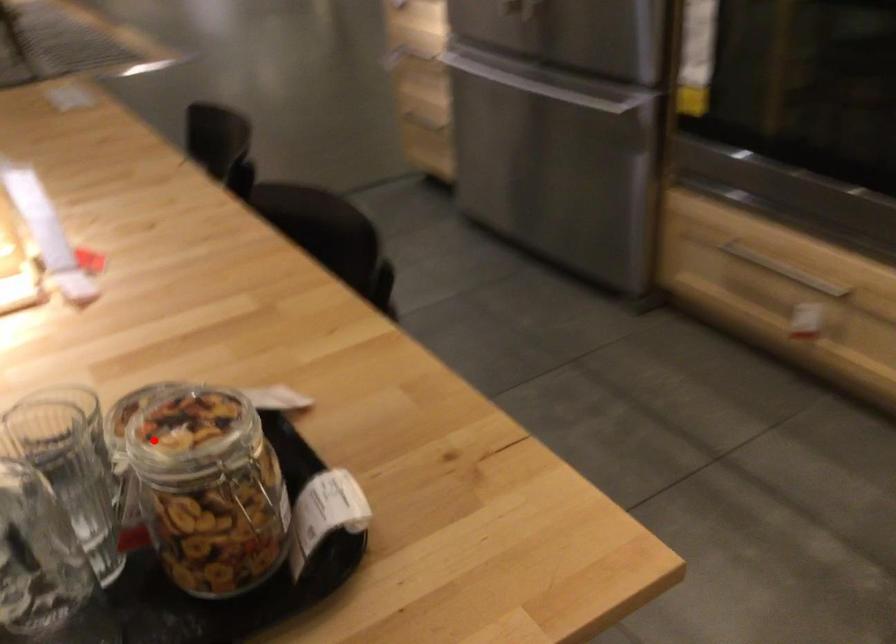
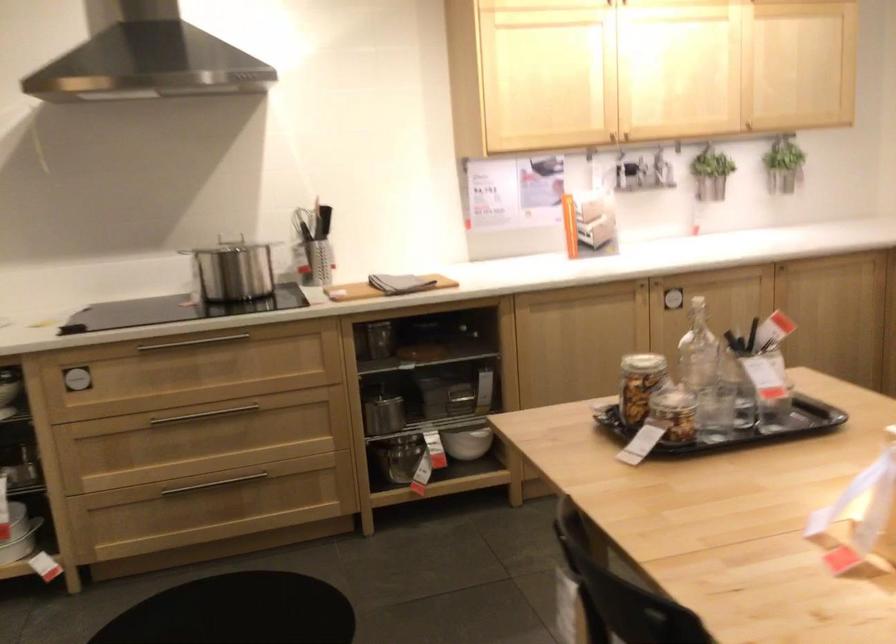
The point at the highlighted location is marked in the first image. Where is the corresponding point in the second image?

(640, 384)